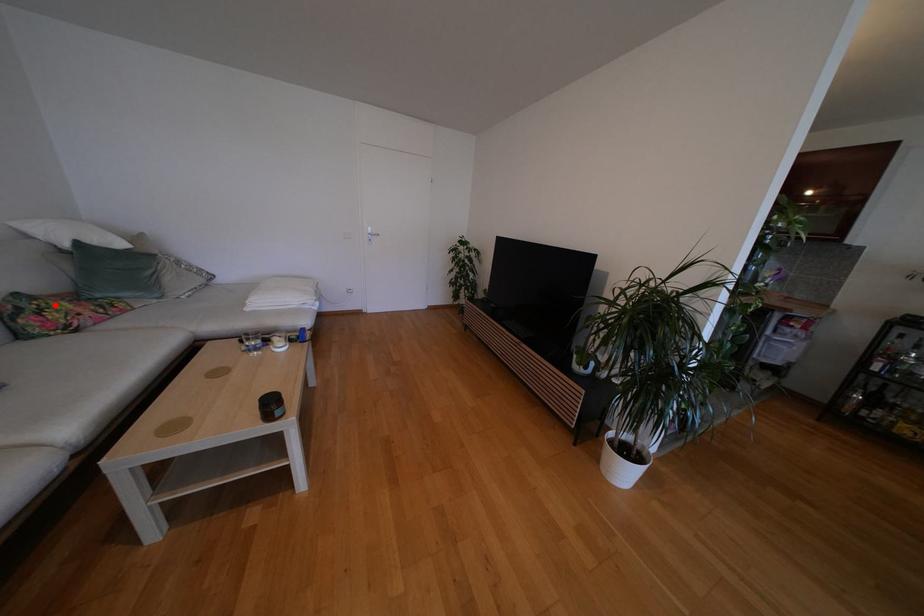
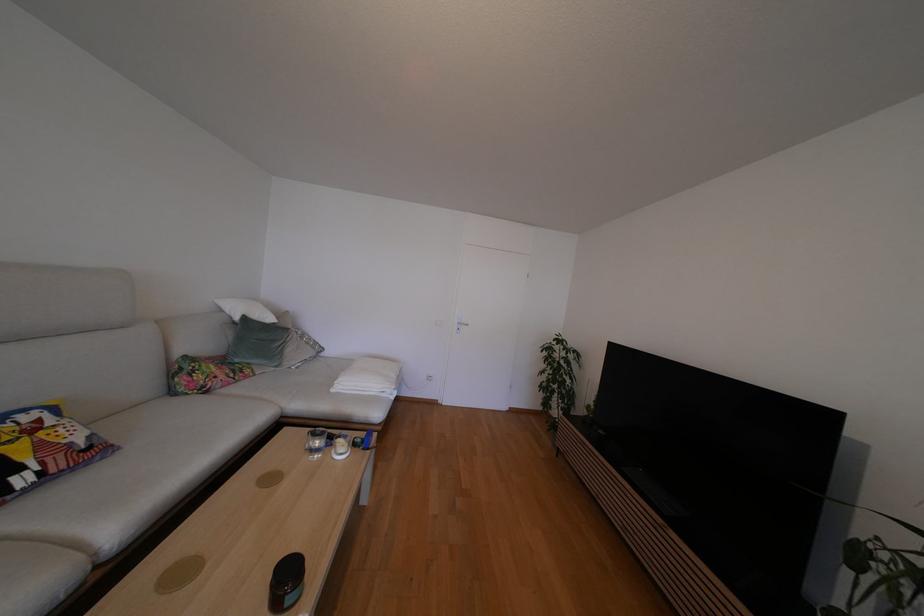
In the second image, find the point that corresponds to the highlighted location in the first image.

(207, 368)